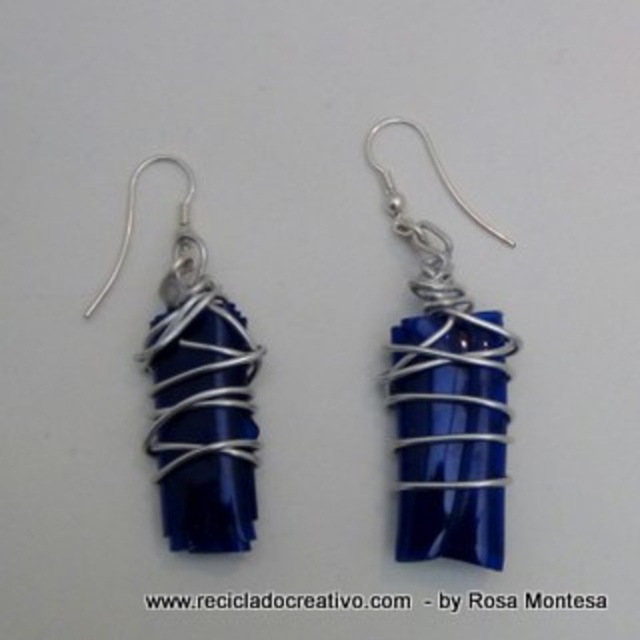
Does blue glass wire at right have a lesser height compared to blue glossy stone at center?

No, blue glass wire at right is not shorter than blue glossy stone at center.

Is blue glass wire at right below blue glossy stone at center?

No.

Is point (416, 282) less distant than point (189, 493)?

That is False.

Locate an element on the screen. This screenshot has width=640, height=640. blue glass wire at right is located at coordinates (445, 396).